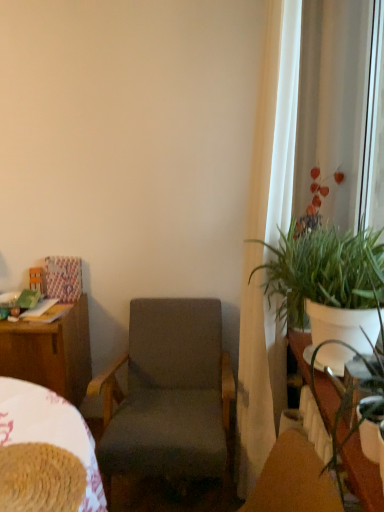
Question: From the image's perspective, is green leafy plant at right on top of white sheer curtain at right?

Choices:
 (A) no
 (B) yes

Answer: (A)

Question: Does green leafy plant at right have a lesser height compared to white sheer curtain at right?

Choices:
 (A) yes
 (B) no

Answer: (A)

Question: From a real-world perspective, is green leafy plant at right positioned under white sheer curtain at right based on gravity?

Choices:
 (A) no
 (B) yes

Answer: (B)

Question: Does green leafy plant at right have a smaller size compared to white sheer curtain at right?

Choices:
 (A) yes
 (B) no

Answer: (A)

Question: Can you confirm if green leafy plant at right is taller than white sheer curtain at right?

Choices:
 (A) yes
 (B) no

Answer: (B)

Question: Is wooden desk at left wider or thinner than woven fabric bed at lower left?

Choices:
 (A) wide
 (B) thin

Answer: (A)

Question: Is point (57, 328) closer or farther from the camera than point (69, 402)?

Choices:
 (A) closer
 (B) farther

Answer: (A)

Question: Considering the positions of wooden desk at left and woven fabric bed at lower left in the image, is wooden desk at left bigger or smaller than woven fabric bed at lower left?

Choices:
 (A) small
 (B) big

Answer: (B)

Question: From the image's perspective, is wooden desk at left above or below woven fabric bed at lower left?

Choices:
 (A) above
 (B) below

Answer: (B)

Question: Choose the correct answer: Is white sheer curtain at right inside dark gray fabric chair at center or outside it?

Choices:
 (A) outside
 (B) inside

Answer: (A)

Question: Considering the positions of white sheer curtain at right and dark gray fabric chair at center in the image, is white sheer curtain at right bigger or smaller than dark gray fabric chair at center?

Choices:
 (A) small
 (B) big

Answer: (A)

Question: From a real-world perspective, relative to dark gray fabric chair at center, is white sheer curtain at right vertically above or below?

Choices:
 (A) above
 (B) below

Answer: (A)

Question: Considering the relative positions of white sheer curtain at right and dark gray fabric chair at center in the image provided, is white sheer curtain at right to the left or to the right of dark gray fabric chair at center?

Choices:
 (A) left
 (B) right

Answer: (B)

Question: From their relative heights in the image, would you say dark gray fabric chair at center is taller or shorter than wooden desk at left?

Choices:
 (A) short
 (B) tall

Answer: (B)

Question: Would you say dark gray fabric chair at center is to the left or to the right of wooden desk at left in the picture?

Choices:
 (A) left
 (B) right

Answer: (B)